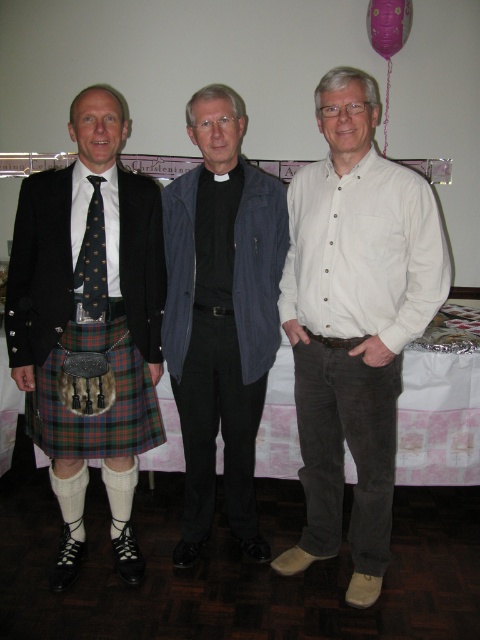
Does tartan fabric kilt at left lie behind purple paper balloon at upper right?

No, tartan fabric kilt at left is closer to the viewer.

From the picture: Who is more distant from viewer, (x=97, y=451) or (x=408, y=8)?

The point (x=408, y=8) is more distant.

Is point (84, 410) more distant than point (376, 42)?

No.

The image size is (480, 640). What are the coordinates of `tartan fabric kilt at left` in the screenshot? It's located at (86, 403).

Can you confirm if white cloth at lower center is positioned below purple paper balloon at upper right?

Correct, white cloth at lower center is located below purple paper balloon at upper right.

The width and height of the screenshot is (480, 640). Describe the element at coordinates (439, 419) in the screenshot. I see `white cloth at lower center` at that location.

At what (x,y) coordinates should I click in order to perform the action: click on white cloth at lower center. Please return your answer as a coordinate pair (x, y). Looking at the image, I should click on pos(439,419).

In order to click on white cloth at lower center in this screenshot , I will do `click(439, 419)`.

Is point (108, 355) positioned after point (103, 282)?

That is True.

Locate an element on the screen. tartan fabric kilt at left is located at coordinates (86, 403).

At what (x,y) coordinates should I click in order to perform the action: click on tartan fabric kilt at left. Please return your answer as a coordinate pair (x, y). Looking at the image, I should click on (86, 403).